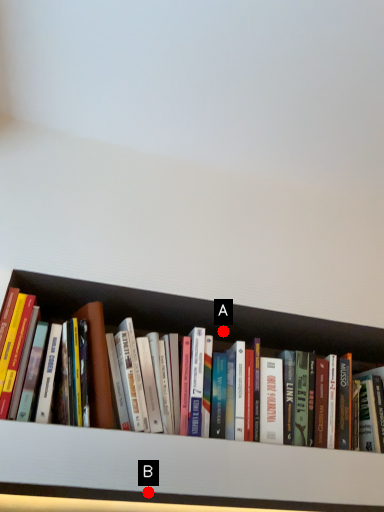
Question: Two points are circled on the image, labeled by A and B beside each circle. Which point appears farthest from the camera in this image?

Choices:
 (A) A is further
 (B) B is further

Answer: (A)